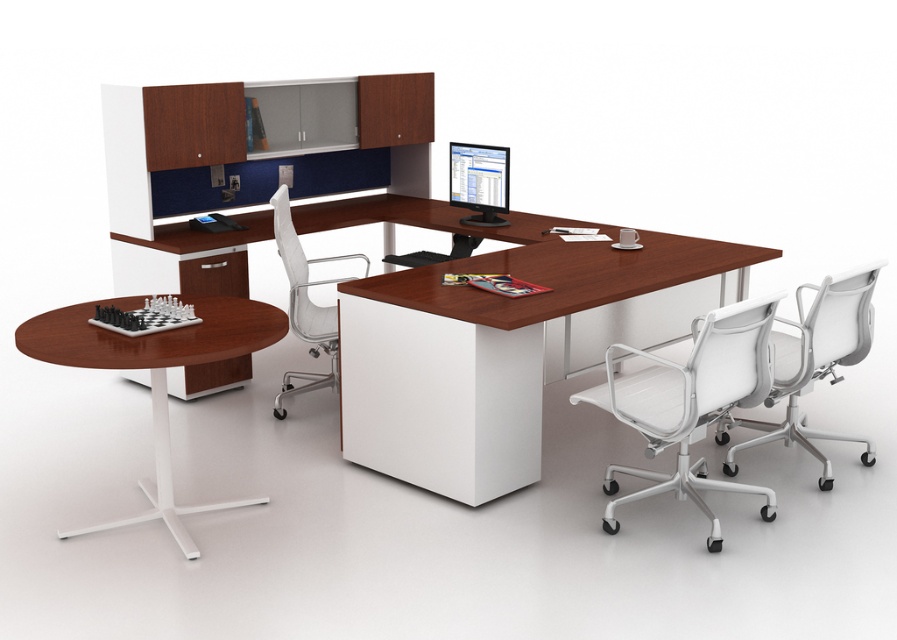
Question: Which point appears closest to the camera in this image?

Choices:
 (A) (479, 266)
 (B) (460, 176)

Answer: (A)

Question: Which point is closer to the camera taking this photo?

Choices:
 (A) (463, 177)
 (B) (797, 356)

Answer: (B)

Question: Where is white mesh swivel chair at lower right located in relation to mahogany wood table at left in the image?

Choices:
 (A) right
 (B) left

Answer: (A)

Question: In this image, where is mahogany wood table at left located relative to matte black monitor at center?

Choices:
 (A) left
 (B) right

Answer: (A)

Question: Can you confirm if mahogany wood table at left is thinner than white plastic swivel chair at right?

Choices:
 (A) yes
 (B) no

Answer: (B)

Question: Among these points, which one is farthest from the camera?

Choices:
 (A) (302, 323)
 (B) (237, 326)

Answer: (A)